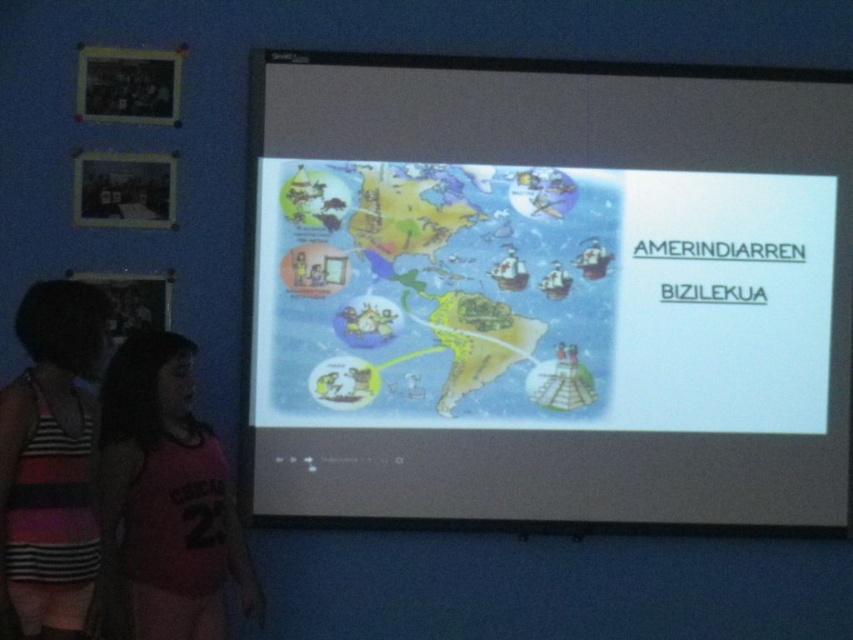
You are a student sitting in the classroom facing the projection screen. You notice two points on the screen at coordinates point (750,342) and point (144,547). Which point appears closer to you?

Point (750,342) is further to the camera than point (144,547), so the point that appears closer to you is point (144,547).

You are a student sitting in the classroom. You notice the white matte projection screen at center and the pink jersey at lower left. Which object is wider in the image?

The white matte projection screen at center is wider than the pink jersey at lower left.